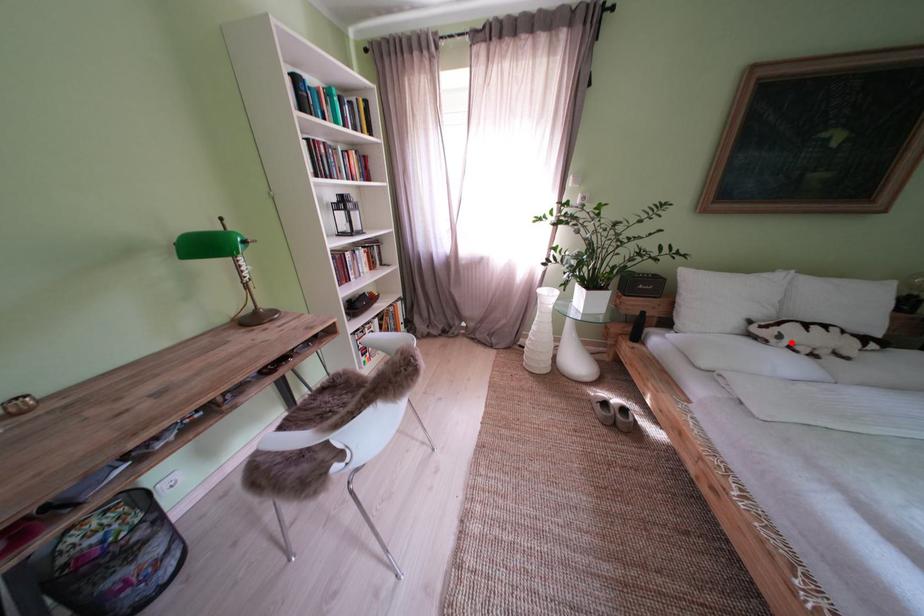
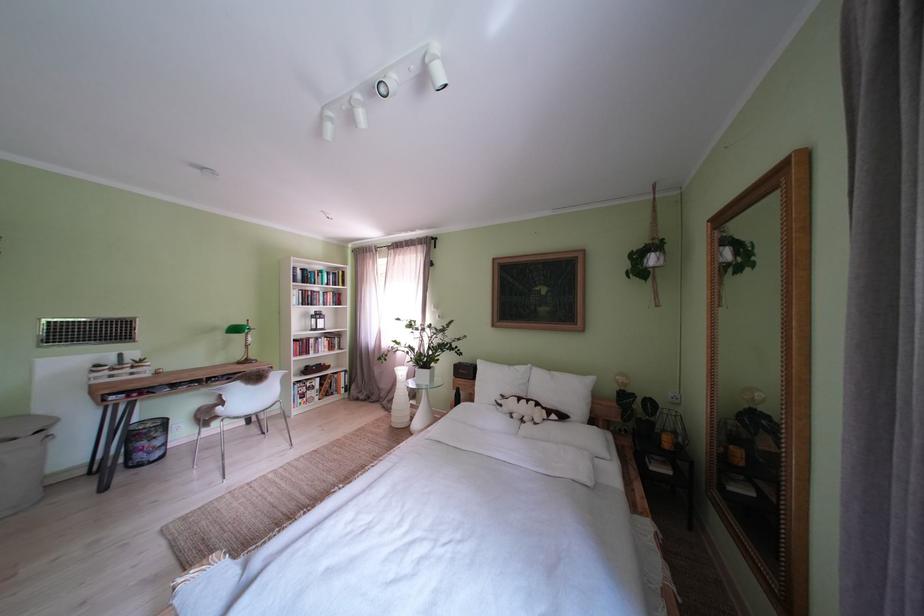
Where in the second image is the point corresponding to the highlighted location from the first image?

(512, 411)